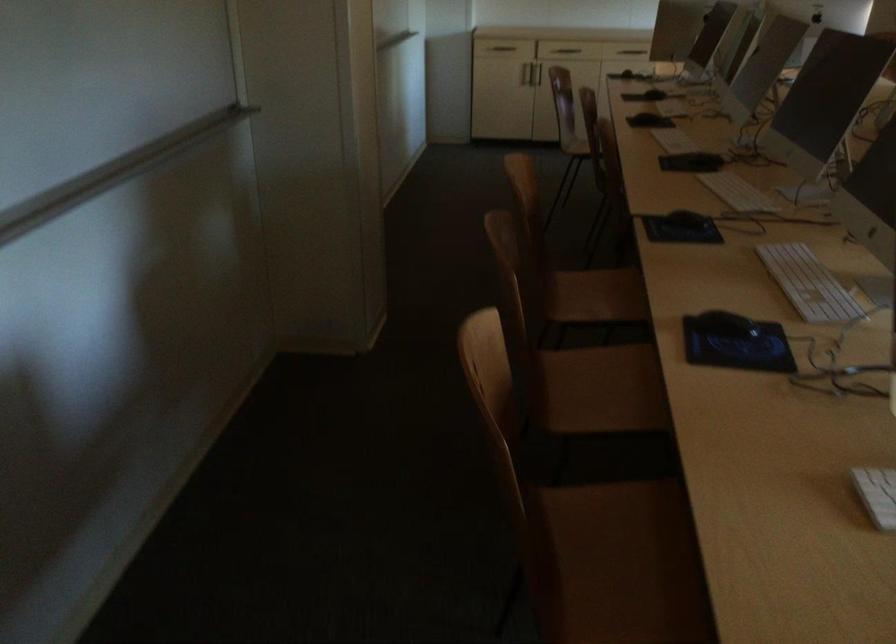
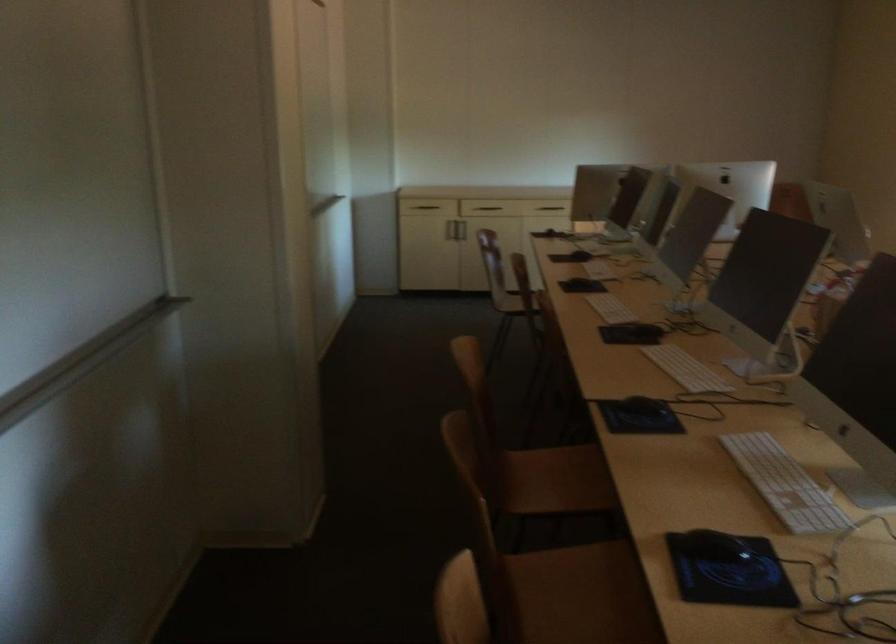
In the second image, find the point that corresponds to point 601,294 in the first image.

(556, 480)